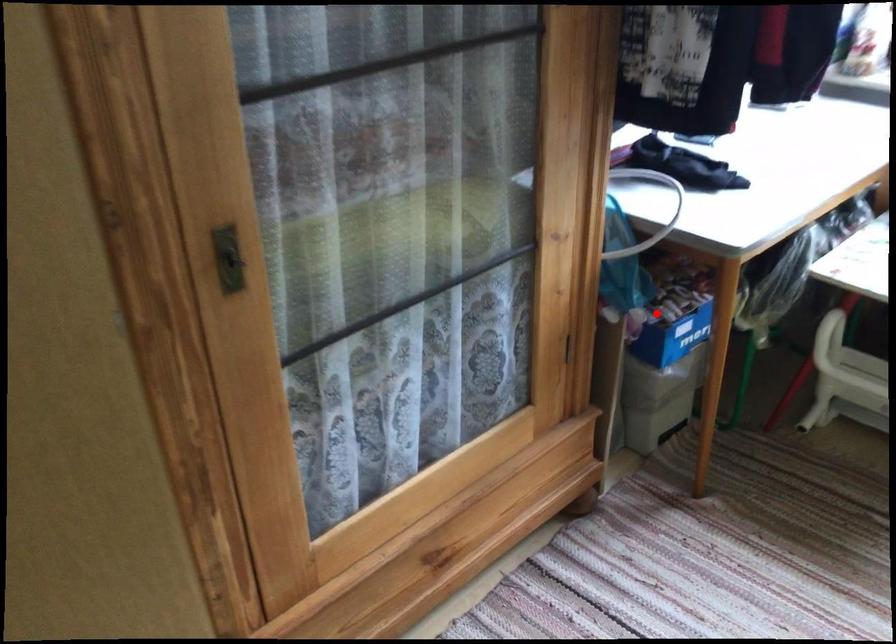
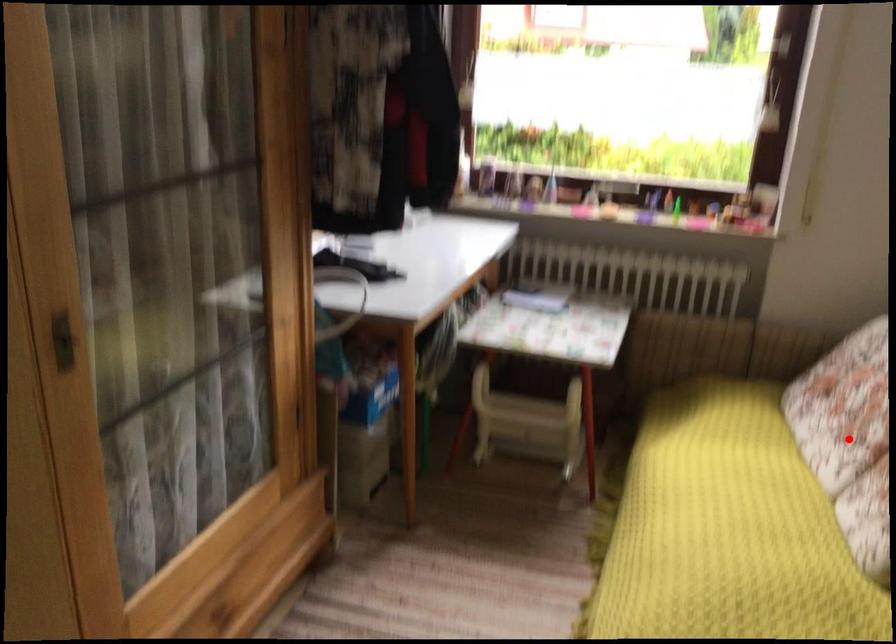
I am providing you with two images of the same scene from different viewpoints. A red point is marked on the first image and another point is marked on the second image. Is the marked point in image1 the same physical position as the marked point in image2?

No